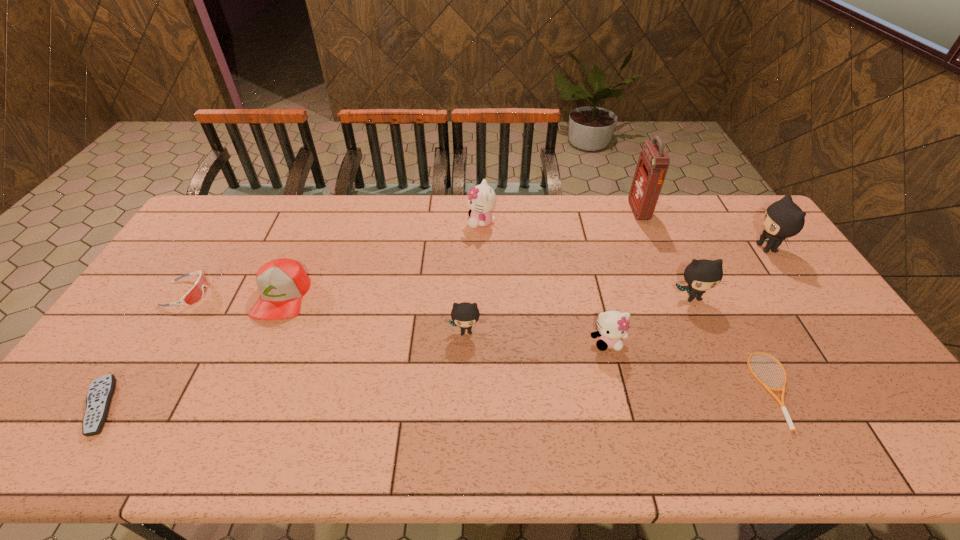
Identify which object is located as the nearest to the second farthest gray kitten. Please provide its 2D coordinates. Your answer should be formatted as a tuple, i.e. [(x, y)], where the tuple contains the x and y coordinates of a point satisfying the conditions above.

[(782, 406)]

Locate which kitten is the fourth closest to the smaller white kitten. Please provide its 2D coordinates. Your answer should be formatted as a tuple, i.e. [(x, y)], where the tuple contains the x and y coordinates of a point satisfying the conditions above.

[(783, 219)]

Identify which kitten is located as the fourth nearest to the second smallest gray kitten. Please provide its 2D coordinates. Your answer should be formatted as a tuple, i.e. [(x, y)], where the tuple contains the x and y coordinates of a point satisfying the conditions above.

[(482, 199)]

Where is `gray kitten that is the closest to the bigger white kitten`? This screenshot has height=540, width=960. gray kitten that is the closest to the bigger white kitten is located at coordinates (x=464, y=315).

Locate which gray kitten ranks second in proximity to the red baseball cap. Please provide its 2D coordinates. Your answer should be formatted as a tuple, i.e. [(x, y)], where the tuple contains the x and y coordinates of a point satisfying the conditions above.

[(701, 275)]

Find the location of a particular element. The width and height of the screenshot is (960, 540). free region that satisfies the following two spatial constraints: 1. on the front-facing side of the third object from left to right; 2. on the right side of the beige tennis racket is located at coordinates (241, 390).

I want to click on free space that satisfies the following two spatial constraints: 1. on the front-facing side of the beige tennis racket; 2. on the left side of the smallest gray kitten, so click(465, 390).

At what (x,y) coordinates should I click in order to perform the action: click on vacant space that satisfies the following two spatial constraints: 1. on the front-facing side of the bigger white kitten; 2. on the front side of the remote control. Please return your answer as a coordinate pair (x, y). The image size is (960, 540). Looking at the image, I should click on [482, 406].